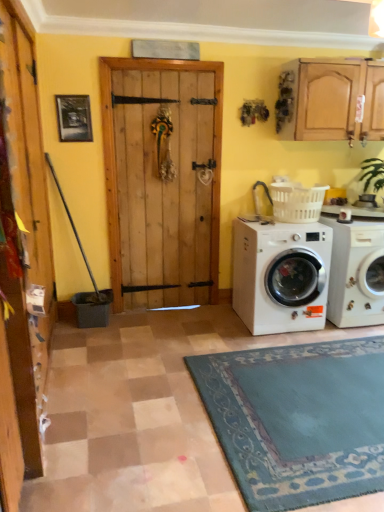
Question: Is white plastic laundry basket at right situated inside white glossy washing machine at lower right, which is the 1th washing machine in right-to-left order, or outside?

Choices:
 (A) inside
 (B) outside

Answer: (B)

Question: From their relative heights in the image, would you say white plastic laundry basket at right is taller or shorter than white glossy washing machine at lower right, which is the 1th washing machine in right-to-left order?

Choices:
 (A) short
 (B) tall

Answer: (A)

Question: Estimate the real-world distances between objects in this image. Which object is farther from the white plastic laundry basket at right?

Choices:
 (A) wooden door at left
 (B) white glossy washing machine at lower right, which is the 1th washing machine in right-to-left order
 (C) white matte washing machine at lower right, which is the second washing machine in right-to-left order

Answer: (A)

Question: Which is nearer to the white plastic laundry basket at right?

Choices:
 (A) wooden door at left
 (B) white glossy washing machine at lower right, which is the 1th washing machine in right-to-left order
 (C) white matte washing machine at lower right, marked as the 1th washing machine in a left-to-right arrangement

Answer: (C)